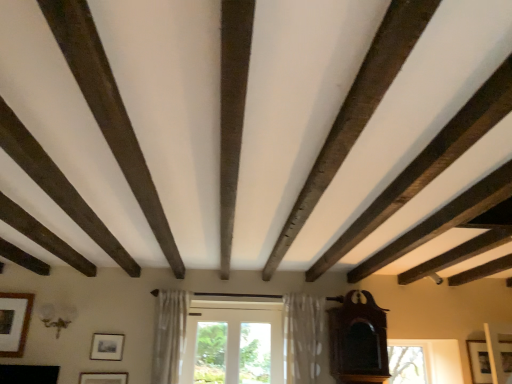
Question: Is matte black picture frame at center, marked as the third picture frame in a right-to-left arrangement, surrounding mahogany wood grandfather clock at right?

Choices:
 (A) yes
 (B) no

Answer: (B)

Question: From the image's perspective, is matte black picture frame at center, the second picture frame viewed from the left, on top of mahogany wood grandfather clock at right?

Choices:
 (A) yes
 (B) no

Answer: (B)

Question: Is matte black picture frame at center, the second picture frame viewed from the left, thinner than mahogany wood grandfather clock at right?

Choices:
 (A) no
 (B) yes

Answer: (B)

Question: Does matte black picture frame at center, the second picture frame viewed from the left, lie in front of mahogany wood grandfather clock at right?

Choices:
 (A) no
 (B) yes

Answer: (A)

Question: From a real-world perspective, is matte black picture frame at center, the second picture frame viewed from the left, physically above mahogany wood grandfather clock at right?

Choices:
 (A) no
 (B) yes

Answer: (A)

Question: Considering the relative sizes of matte black picture frame at center, marked as the third picture frame in a right-to-left arrangement, and mahogany wood grandfather clock at right in the image provided, is matte black picture frame at center, marked as the third picture frame in a right-to-left arrangement, smaller than mahogany wood grandfather clock at right?

Choices:
 (A) no
 (B) yes

Answer: (B)

Question: Does matte gold picture frame at lower center, which ranks as the third picture frame in left-to-right order, have a lesser width compared to matte black picture frame at center, the second picture frame viewed from the left?

Choices:
 (A) yes
 (B) no

Answer: (B)

Question: Is matte black picture frame at center, marked as the third picture frame in a right-to-left arrangement, at the back of matte gold picture frame at lower center, the 2th picture frame from the right?

Choices:
 (A) no
 (B) yes

Answer: (A)

Question: Are matte gold picture frame at lower center, which ranks as the third picture frame in left-to-right order, and matte black picture frame at center, the second picture frame viewed from the left, far apart?

Choices:
 (A) yes
 (B) no

Answer: (B)

Question: Can you confirm if matte gold picture frame at lower center, which ranks as the third picture frame in left-to-right order, is shorter than matte black picture frame at center, marked as the third picture frame in a right-to-left arrangement?

Choices:
 (A) yes
 (B) no

Answer: (B)

Question: From a real-world perspective, is matte gold picture frame at lower center, which ranks as the third picture frame in left-to-right order, beneath matte black picture frame at center, the second picture frame viewed from the left?

Choices:
 (A) no
 (B) yes

Answer: (B)

Question: From the image's perspective, is matte gold picture frame at lower center, the 2th picture frame from the right, under matte black picture frame at center, the second picture frame viewed from the left?

Choices:
 (A) yes
 (B) no

Answer: (A)

Question: Is matte gold picture frame at lower center, the 2th picture frame from the right, thinner than mahogany wood grandfather clock at right?

Choices:
 (A) yes
 (B) no

Answer: (A)